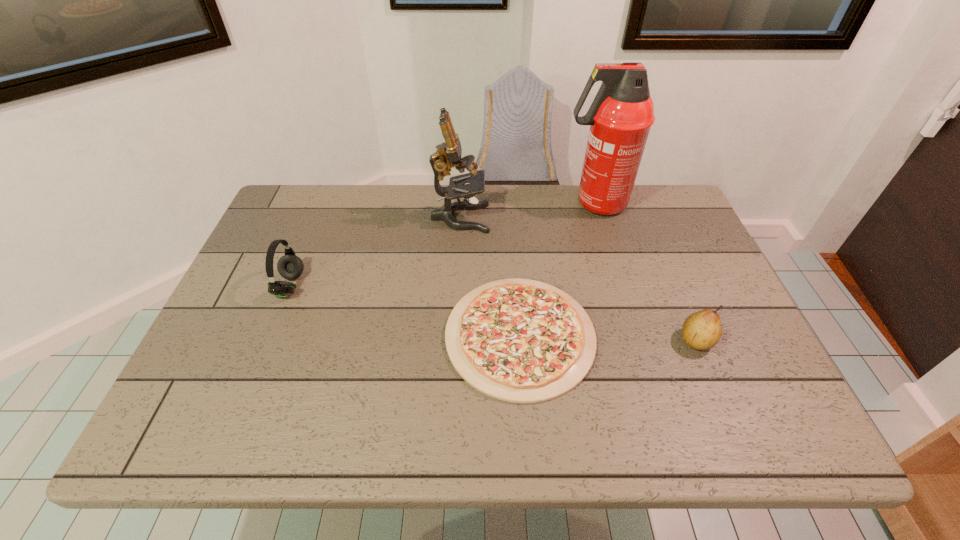
You are a GUI agent. You are given a task and a screenshot of the screen. Output one action in this format:
    pyautogui.click(x=<x>, y=<y>)
    Task: Click on the tallest object
    
    Given the screenshot: What is the action you would take?
    pyautogui.click(x=620, y=117)

At what (x,y) coordinates should I click in order to perform the action: click on microscope. Please return your answer as a coordinate pair (x, y). The image size is (960, 540). Looking at the image, I should click on (448, 155).

The width and height of the screenshot is (960, 540). Identify the location of the leftmost object. (289, 266).

Where is `headset`? The height and width of the screenshot is (540, 960). headset is located at coordinates (289, 266).

The height and width of the screenshot is (540, 960). Identify the location of pear. (702, 330).

This screenshot has width=960, height=540. In order to click on the shortest object in this screenshot , I will do `click(523, 341)`.

Locate an element on the screen. Image resolution: width=960 pixels, height=540 pixels. vacant space located 0.170m on the trigger side of the fire extinguisher is located at coordinates (506, 204).

Identify the location of free point located on the trigger side of the fire extinguisher. (465, 204).

You are a GUI agent. You are given a task and a screenshot of the screen. Output one action in this format:
    pyautogui.click(x=<x>, y=<y>)
    Task: Click on the free region located on the trigger side of the fire extinguisher
    Image resolution: width=960 pixels, height=540 pixels.
    Given the screenshot: What is the action you would take?
    pyautogui.click(x=451, y=204)

The width and height of the screenshot is (960, 540). I want to click on vacant region located at the eyepieces of the fourth shortest object, so click(526, 218).